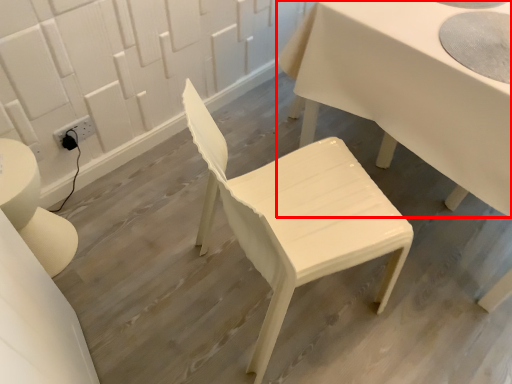
Question: In this image, where is table (annotated by the red box) located relative to chair?

Choices:
 (A) left
 (B) right

Answer: (B)